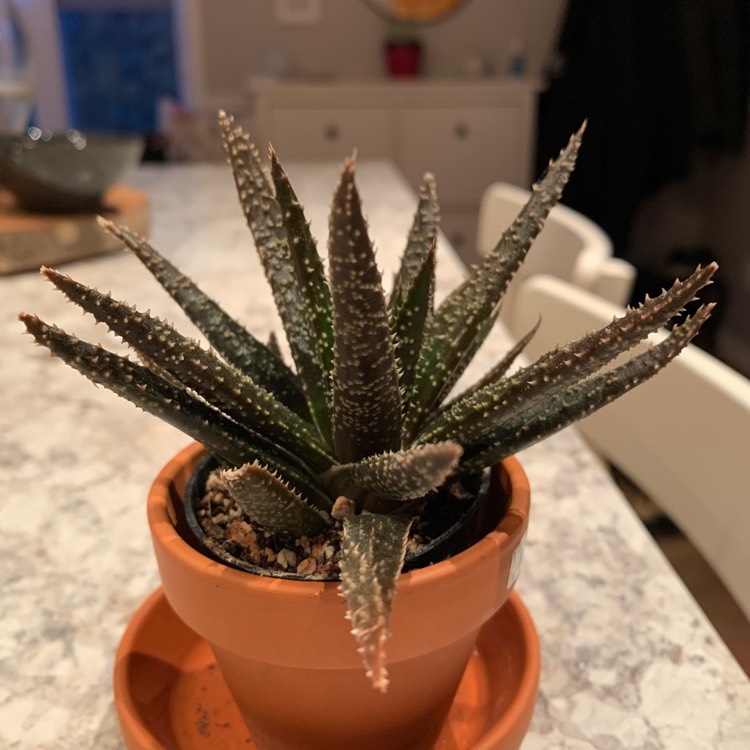
You are a GUI agent. You are given a task and a screenshot of the screen. Output one action in this format:
    pyautogui.click(x=<x>, y=<y>)
    Task: Click on the front chair
    Image resolution: width=750 pixels, height=750 pixels.
    Given the screenshot: What is the action you would take?
    pyautogui.click(x=706, y=420)